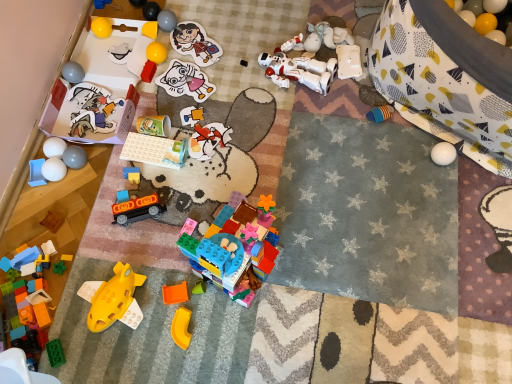
Where is `vacant region to the left of matte paper sticker at center, the seventh toy viewed from the right`? The width and height of the screenshot is (512, 384). vacant region to the left of matte paper sticker at center, the seventh toy viewed from the right is located at coordinates (151, 95).